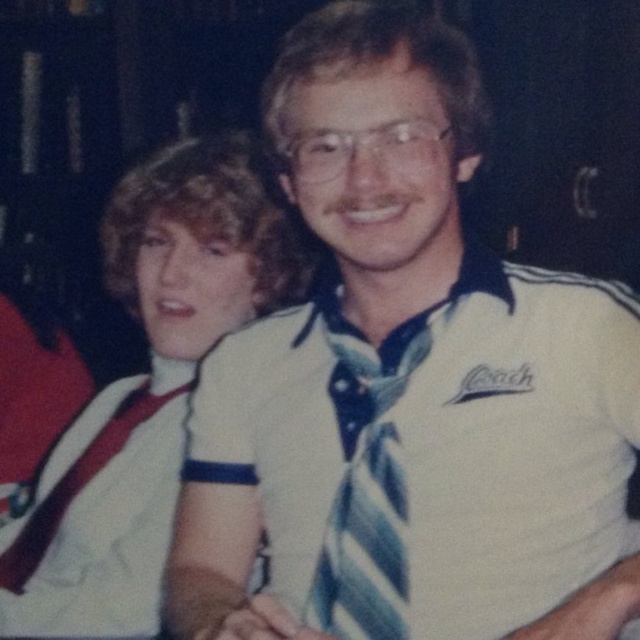
Question: Considering the relative positions of white cotton shirt at center and white cotton shirt at left in the image provided, where is white cotton shirt at center located with respect to white cotton shirt at left?

Choices:
 (A) right
 (B) left

Answer: (A)

Question: Which object is the closest to the blue striped tie at center?

Choices:
 (A) white fabric shirt at upper left
 (B) white cotton shirt at left
 (C) white cotton shirt at center

Answer: (C)

Question: Which point is farther to the camera?

Choices:
 (A) white cotton shirt at center
 (B) white cotton shirt at left

Answer: (B)

Question: Is white cotton shirt at center below white cotton shirt at left?

Choices:
 (A) no
 (B) yes

Answer: (A)

Question: Estimate the real-world distances between objects in this image. Which object is closer to the white fabric shirt at upper left?

Choices:
 (A) white cotton shirt at left
 (B) blue striped tie at center

Answer: (A)

Question: Where is white fabric shirt at upper left located in relation to blue striped tie at center in the image?

Choices:
 (A) left
 (B) right

Answer: (A)